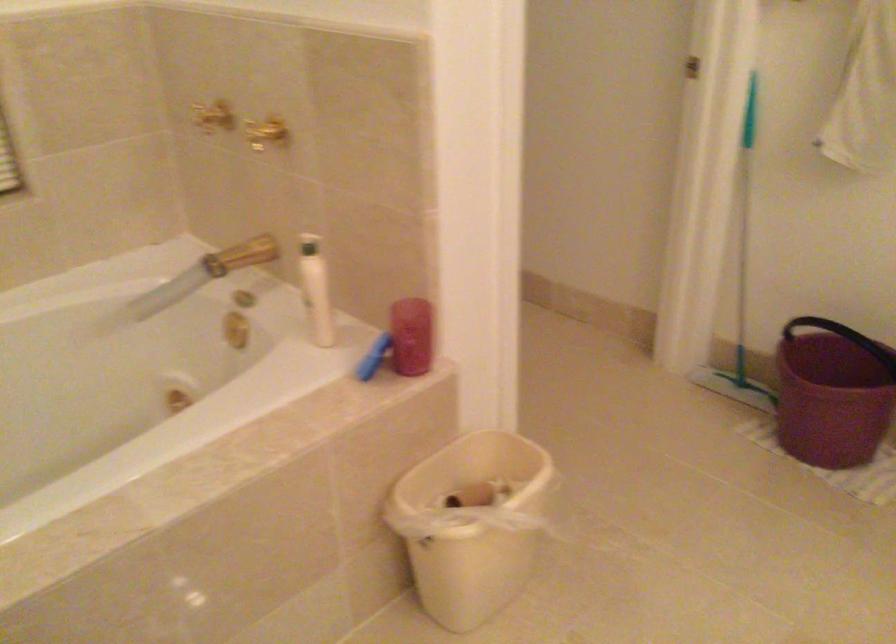
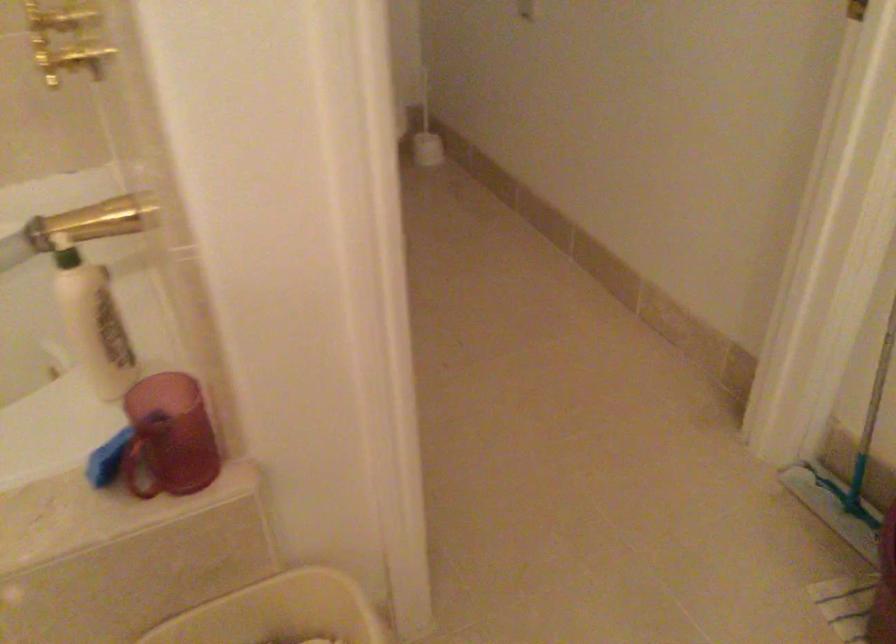
Question: The images are taken continuously from a first-person perspective. In which direction is your viewpoint rotating?

Choices:
 (A) Left
 (B) Right
 (C) Up
 (D) Down

Answer: (A)